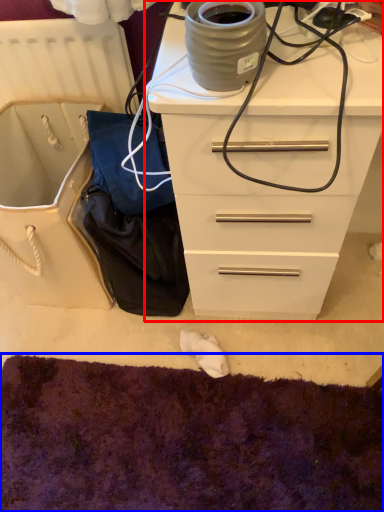
Question: Which object appears closest to the camera in this image, chest of drawers (highlighted by a red box) or cat bed (highlighted by a blue box)?

Choices:
 (A) chest of drawers
 (B) cat bed

Answer: (A)